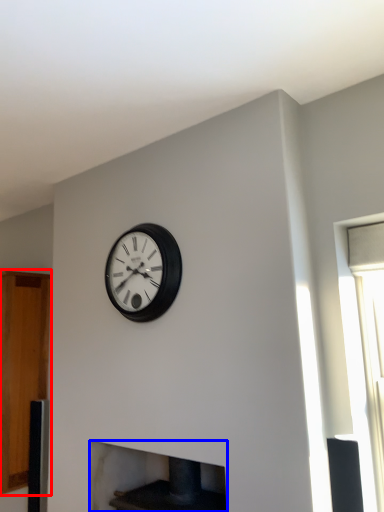
Question: Which object is further to the camera taking this photo, cabinetry (highlighted by a red box) or fireplace (highlighted by a blue box)?

Choices:
 (A) cabinetry
 (B) fireplace

Answer: (A)